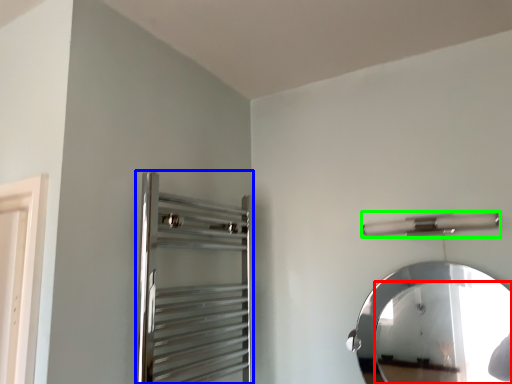
Question: Considering the real-world distances, which object is farthest from mirror (highlighted by a red box)? screen door (highlighted by a blue box) or towel bar (highlighted by a green box)?

Choices:
 (A) screen door
 (B) towel bar

Answer: (A)